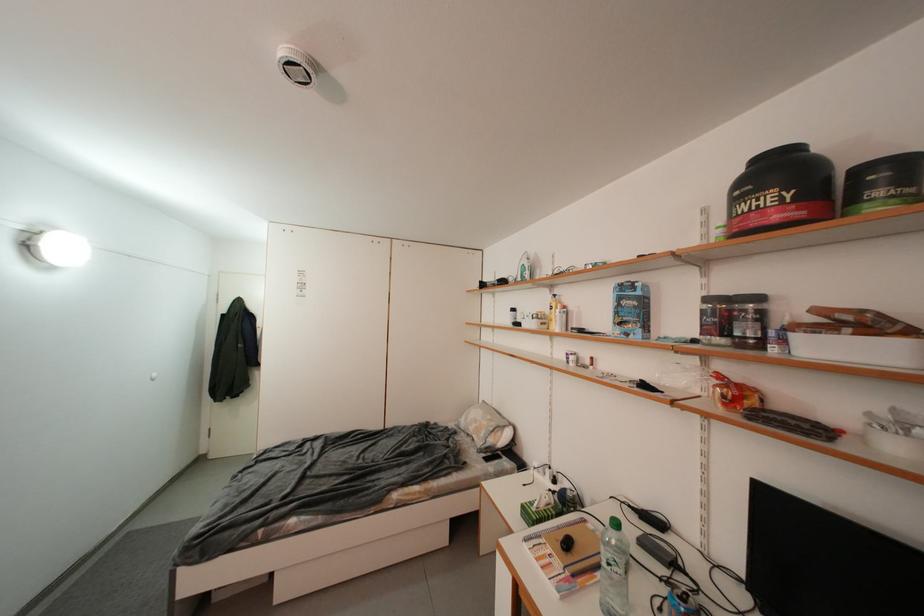
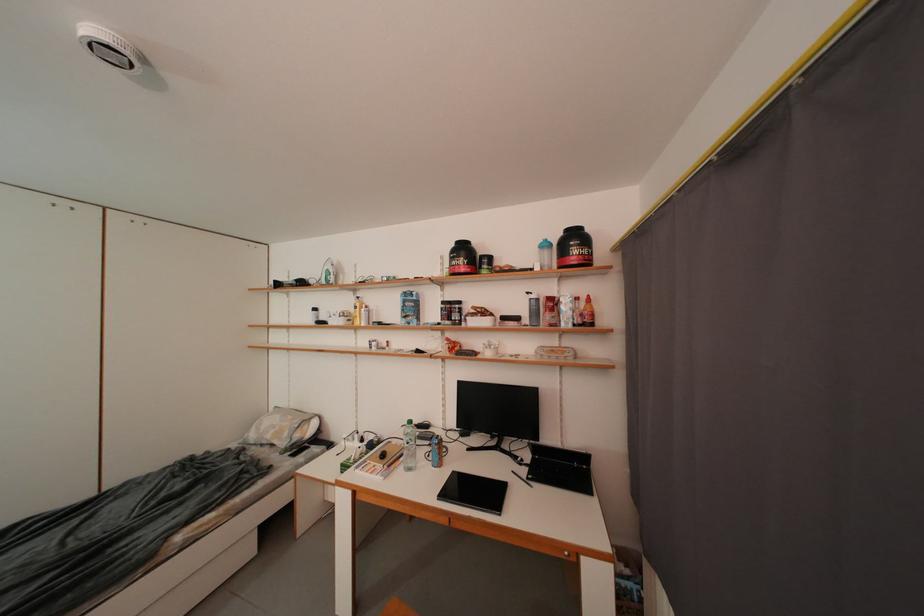
Find the pixel in the second image that matches [733,408] in the first image.

(457, 355)